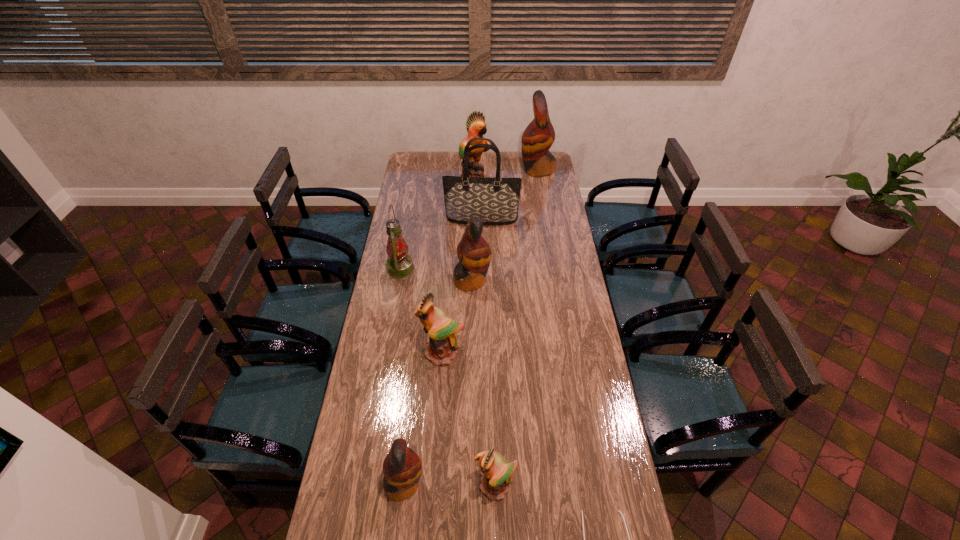
Locate an element on the screen. The height and width of the screenshot is (540, 960). vacant space at the right edge is located at coordinates (557, 265).

Locate an element on the screen. vacant space at the far left corner of the desktop is located at coordinates (421, 168).

Identify the location of empty space between the second red parrot from left to right and the smallest green parrot. (484, 383).

Where is `vacant area that lies between the second red parrot from left to right and the green oil lamp`? This screenshot has height=540, width=960. vacant area that lies between the second red parrot from left to right and the green oil lamp is located at coordinates 437,274.

Find the location of a particular element. This screenshot has width=960, height=540. free area in between the second red parrot from right to left and the second biggest green parrot is located at coordinates (457, 317).

Where is `the seventh closest object to the farthest red parrot`? the seventh closest object to the farthest red parrot is located at coordinates (402, 467).

At what (x,y) coordinates should I click in order to perform the action: click on object that can be found as the second closest to the fourth nearest object. Please return your answer as a coordinate pair (x, y). Looking at the image, I should click on [399, 263].

Identify the location of the fourth closest parrot to the fourth farthest parrot. The image size is (960, 540). (476, 126).

This screenshot has width=960, height=540. Find the location of `the fifth closest parrot to the tote bag`. the fifth closest parrot to the tote bag is located at coordinates (402, 467).

At what (x,y) coordinates should I click in order to perform the action: click on green parrot that is the closest to the second farthest green parrot. Please return your answer as a coordinate pair (x, y). Looking at the image, I should click on (496, 472).